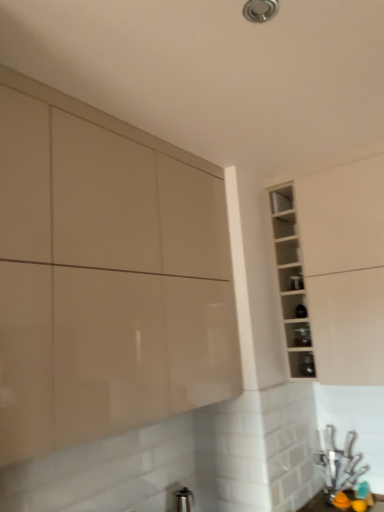
Question: Does glossy beige cabinet at upper left, placed as the 2th cabinetry when sorted from right to left, have a larger size compared to white glossy cabinet at upper right, the 1th cabinetry in the right-to-left sequence?

Choices:
 (A) no
 (B) yes

Answer: (B)

Question: Can you confirm if glossy beige cabinet at upper left, arranged as the 1th cabinetry when viewed from the left, is shorter than white glossy cabinet at upper right, the 1th cabinetry in the right-to-left sequence?

Choices:
 (A) yes
 (B) no

Answer: (B)

Question: Is glossy beige cabinet at upper left, placed as the 2th cabinetry when sorted from right to left, surrounding white glossy cabinet at upper right, which appears as the 2th cabinetry when viewed from the left?

Choices:
 (A) no
 (B) yes

Answer: (A)

Question: From the image's perspective, is glossy beige cabinet at upper left, placed as the 2th cabinetry when sorted from right to left, located above white glossy cabinet at upper right, which appears as the 2th cabinetry when viewed from the left?

Choices:
 (A) no
 (B) yes

Answer: (A)

Question: Can you confirm if glossy beige cabinet at upper left, placed as the 2th cabinetry when sorted from right to left, is positioned to the right of white glossy cabinet at upper right, which appears as the 2th cabinetry when viewed from the left?

Choices:
 (A) no
 (B) yes

Answer: (A)

Question: In the image, is clear glass shelf at upper right, arranged as the third shelf when viewed from the top, on the left side or the right side of glossy beige cabinet at upper left, arranged as the 1th cabinetry when viewed from the left?

Choices:
 (A) right
 (B) left

Answer: (A)

Question: Is clear glass shelf at upper right, arranged as the third shelf when viewed from the top, bigger or smaller than glossy beige cabinet at upper left, arranged as the 1th cabinetry when viewed from the left?

Choices:
 (A) big
 (B) small

Answer: (B)

Question: From the image's perspective, relative to glossy beige cabinet at upper left, placed as the 2th cabinetry when sorted from right to left, is clear glass shelf at upper right, marked as the first shelf in a bottom-to-top arrangement, above or below?

Choices:
 (A) below
 (B) above

Answer: (A)

Question: Is clear glass shelf at upper right, arranged as the third shelf when viewed from the top, situated inside glossy beige cabinet at upper left, placed as the 2th cabinetry when sorted from right to left, or outside?

Choices:
 (A) inside
 (B) outside

Answer: (B)

Question: In terms of height, does matte black shelf at center-right, placed as the second shelf when sorted from top to bottom, look taller or shorter compared to clear glass shelf at upper right, marked as the first shelf in a bottom-to-top arrangement?

Choices:
 (A) tall
 (B) short

Answer: (B)

Question: Is point tap(294, 331) closer or farther from the camera than point tap(311, 352)?

Choices:
 (A) farther
 (B) closer

Answer: (A)

Question: Is matte black shelf at center-right, placed as the second shelf when sorted from top to bottom, spatially inside clear glass shelf at upper right, marked as the first shelf in a bottom-to-top arrangement, or outside of it?

Choices:
 (A) inside
 (B) outside

Answer: (B)

Question: Looking at the image, does matte black shelf at center-right, the 2th shelf in the bottom-to-top sequence, seem bigger or smaller compared to clear glass shelf at upper right, marked as the first shelf in a bottom-to-top arrangement?

Choices:
 (A) big
 (B) small

Answer: (B)

Question: Which is correct: white glossy cabinet at upper right, the 1th cabinetry in the right-to-left sequence, is inside transparent glass shelf at upper right, which appears as the 3th shelf when ordered from the bottom, or outside of it?

Choices:
 (A) inside
 (B) outside

Answer: (B)

Question: In terms of width, does white glossy cabinet at upper right, the 1th cabinetry in the right-to-left sequence, look wider or thinner when compared to transparent glass shelf at upper right, which appears as the 3th shelf when ordered from the bottom?

Choices:
 (A) thin
 (B) wide

Answer: (B)